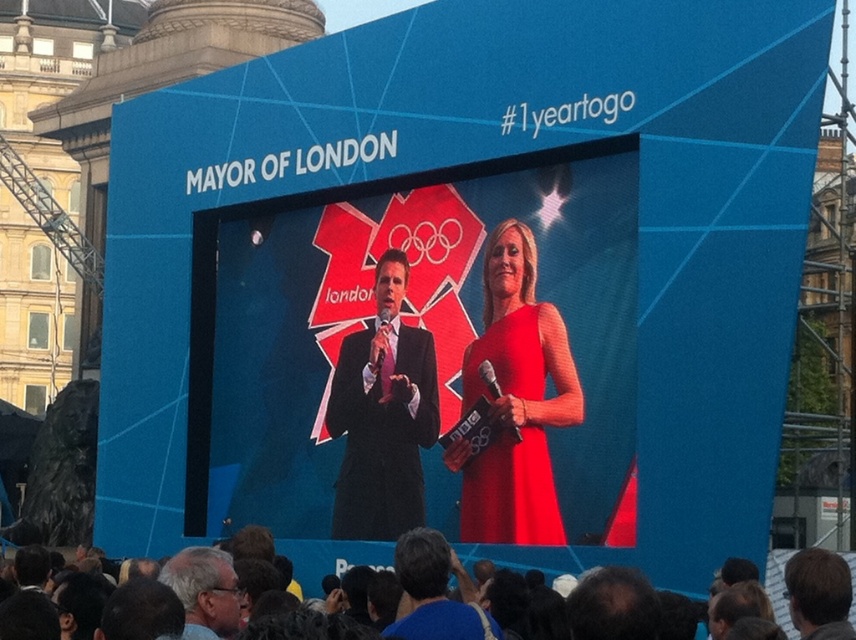
You are attending the 2012 London Olympics event and notice two features in the scene. One is the dark blue fabric at lower center, and the other is the gray hair at lower center. Which of these two features is closer to you?

The dark blue fabric at lower center is closer to you because it is further to the viewer than the gray hair at lower center.

You are standing at the center of the stage in the image. There is a point marked at coordinates [383,416]. What object is located at this point?

The point at coordinates [383,416] marks the matte black suit at center.

You are attending the 2012 London Olympics event and notice the matte red dress at center and the dark blue fabric at lower center. Which object is taller in the image?

The matte red dress at center is taller than the dark blue fabric at lower center.